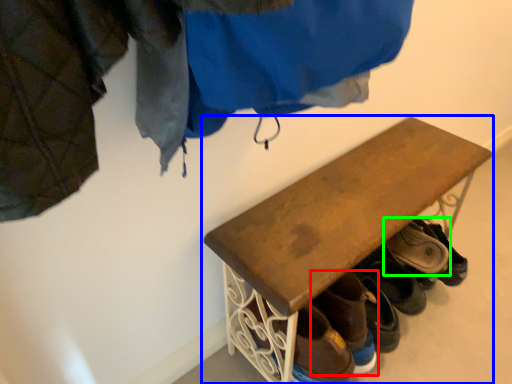
Question: Which object is the closest to the footwear (highlighted by a red box)? Choose among these: furniture (highlighted by a blue box) or footwear (highlighted by a green box).

Choices:
 (A) furniture
 (B) footwear

Answer: (A)